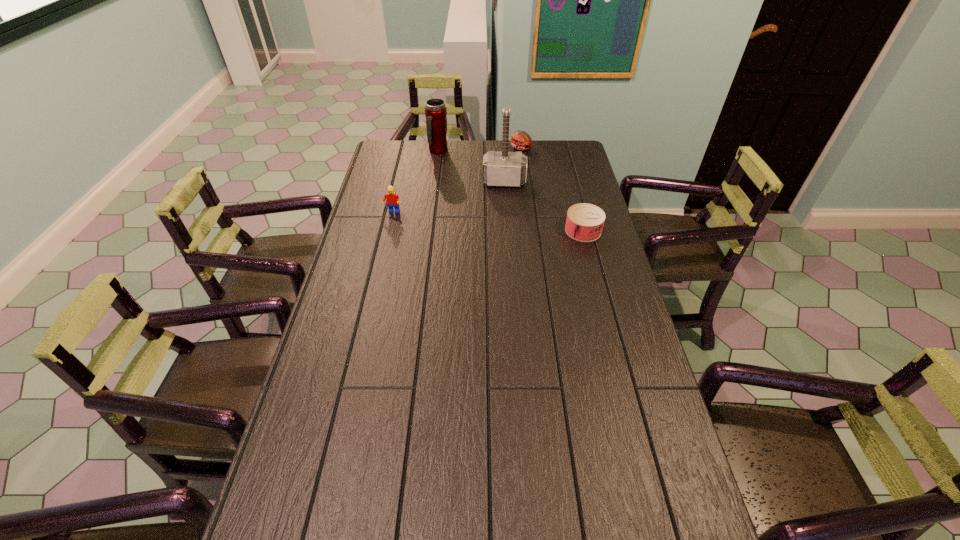
I want to click on vacant spot on the desktop that is between the leftmost object and the nearest object and is positioned on the front-facing side of the tomato, so click(x=481, y=221).

Identify the location of free spot on the desktop that is between the third shortest object and the rightmost object and is positioned for striking with the head of the tallest object. (503, 223).

What are the coordinates of `free space on the desktop that is between the Lego and the nearest object and is positioned on the side with the handle of the second object from left to right` in the screenshot? It's located at (472, 220).